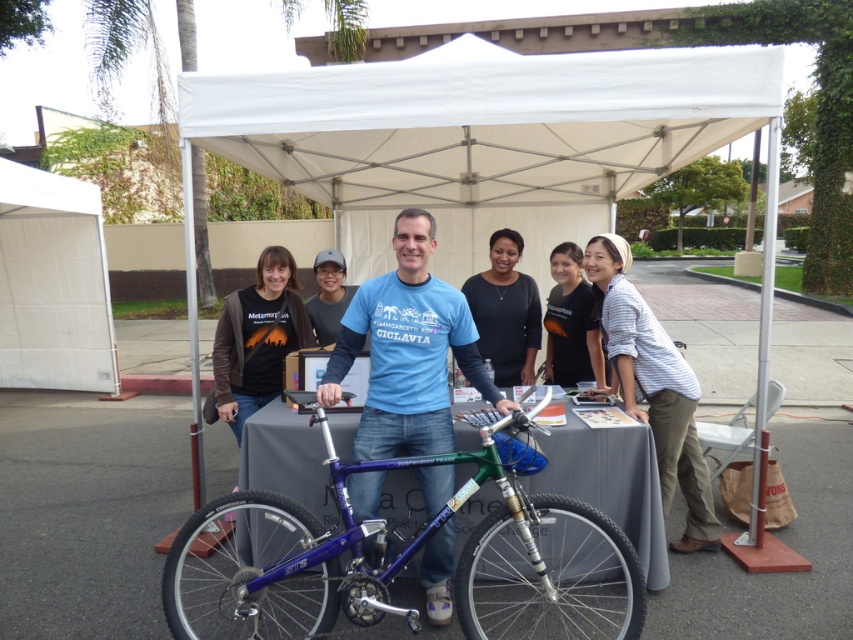
Does white fabric tent at center lie in front of blue fabric shirt at center?

No, white fabric tent at center is behind blue fabric shirt at center.

Who is positioned more to the right, white fabric tent at center or blue fabric shirt at center?

white fabric tent at center

Does point (598, 227) lie in front of point (341, 349)?

No, (598, 227) is behind (341, 349).

The image size is (853, 640). Find the location of `white fabric tent at center`. white fabric tent at center is located at coordinates point(480,138).

Is white fabric tent at center below white fabric canopy at left?

Actually, white fabric tent at center is above white fabric canopy at left.

Does white fabric tent at center have a lesser height compared to white fabric canopy at left?

Indeed, white fabric tent at center has a lesser height compared to white fabric canopy at left.

What do you see at coordinates (480, 138) in the screenshot? I see `white fabric tent at center` at bounding box center [480, 138].

The image size is (853, 640). Identify the location of white fabric tent at center. (480, 138).

Is black matte shirt at center shorter than dark gray sweater at center?

No, black matte shirt at center is not shorter than dark gray sweater at center.

Is point (204, 404) closer to camera compared to point (540, 333)?

No.

Where is `black matte shirt at center`? black matte shirt at center is located at coordinates (256, 340).